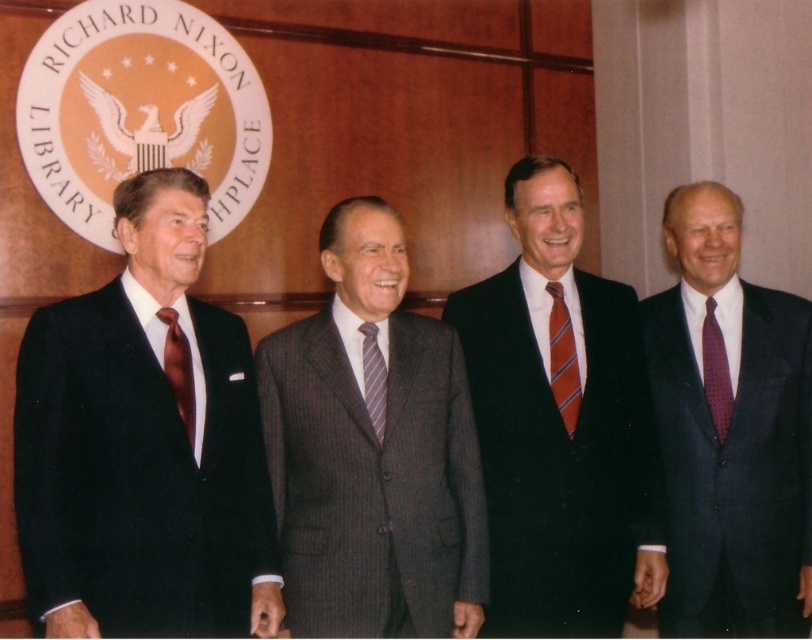
Question: Based on their relative distances, which object is nearer to the dark red dotted tie at right?

Choices:
 (A) gray pinstripe suit at center
 (B) striped silk tie at center
 (C) striped fabric tie at center
 (D) matte black suit at left

Answer: (B)

Question: Is gray pinstripe suit at center to the right of satin brown tie at left from the viewer's perspective?

Choices:
 (A) no
 (B) yes

Answer: (B)

Question: Considering the real-world distances, which object is farthest from the dark blue suit at right?

Choices:
 (A) striped silk tie at center
 (B) dark red dotted tie at right
 (C) satin brown tie at left
 (D) gray pinstripe suit at center

Answer: (C)

Question: Does matte black suit at left have a lesser width compared to striped silk tie at center?

Choices:
 (A) no
 (B) yes

Answer: (A)

Question: Which point is farther to the camera?

Choices:
 (A) (573, 353)
 (B) (205, 618)
 (C) (162, 355)

Answer: (A)

Question: Is dark blue suit at right behind striped silk tie at center?

Choices:
 (A) no
 (B) yes

Answer: (B)